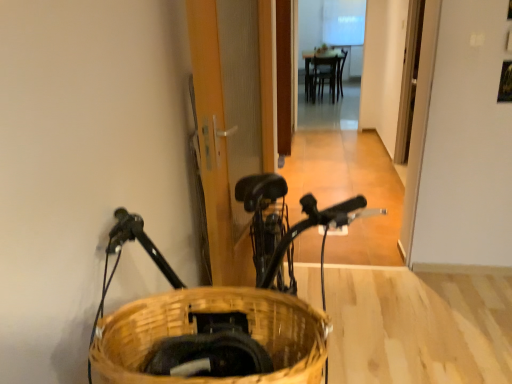
This screenshot has width=512, height=384. I want to click on wooden textured chair at center, so click(x=324, y=73).

This screenshot has width=512, height=384. Describe the element at coordinates (324, 73) in the screenshot. I see `wooden textured chair at center` at that location.

The height and width of the screenshot is (384, 512). I want to click on wooden textured chair at center, so click(324, 73).